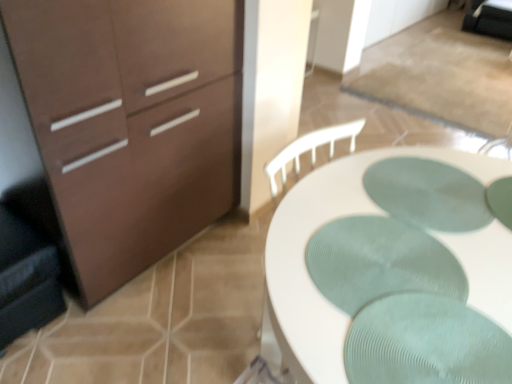
The width and height of the screenshot is (512, 384). I want to click on empty space that is to the right of green ribbed placemat at center, the second oval from the top, so click(x=482, y=251).